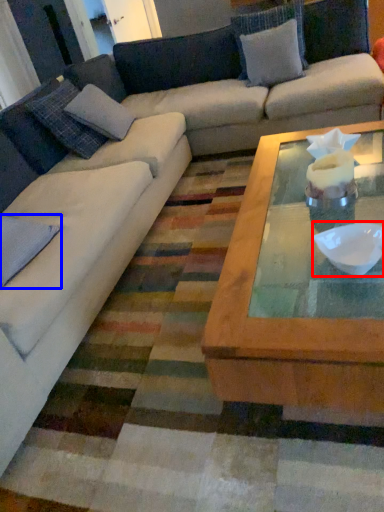
Question: Which object is further to the camera taking this photo, bowl (highlighted by a red box) or pillow (highlighted by a blue box)?

Choices:
 (A) bowl
 (B) pillow

Answer: (B)